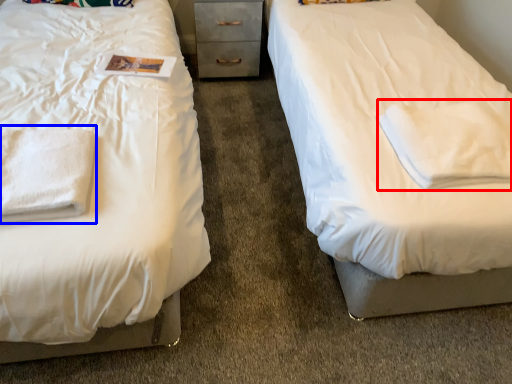
Question: Which object is closer to the camera taking this photo, cloth (highlighted by a red box) or cloth (highlighted by a blue box)?

Choices:
 (A) cloth
 (B) cloth

Answer: (B)